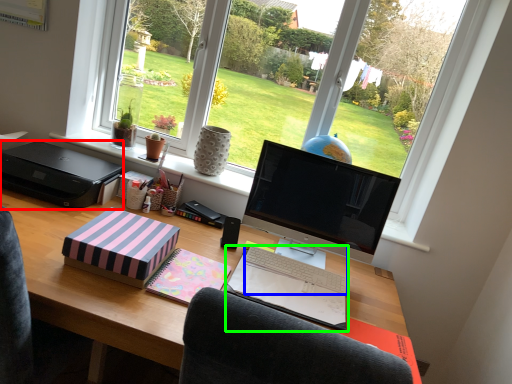
Question: Based on their relative distances, which object is farther from printer (highlighted by a red box)? Choose from computer keyboard (highlighted by a blue box) and notebook (highlighted by a green box).

Choices:
 (A) computer keyboard
 (B) notebook

Answer: (A)